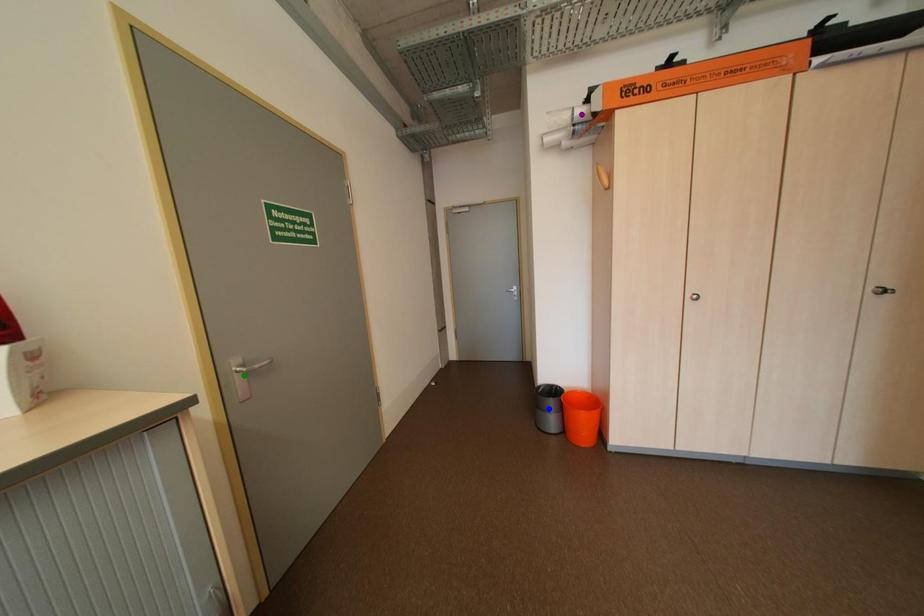
Order these from nearest to farthest:
1. purple point
2. blue point
3. green point

green point < purple point < blue point